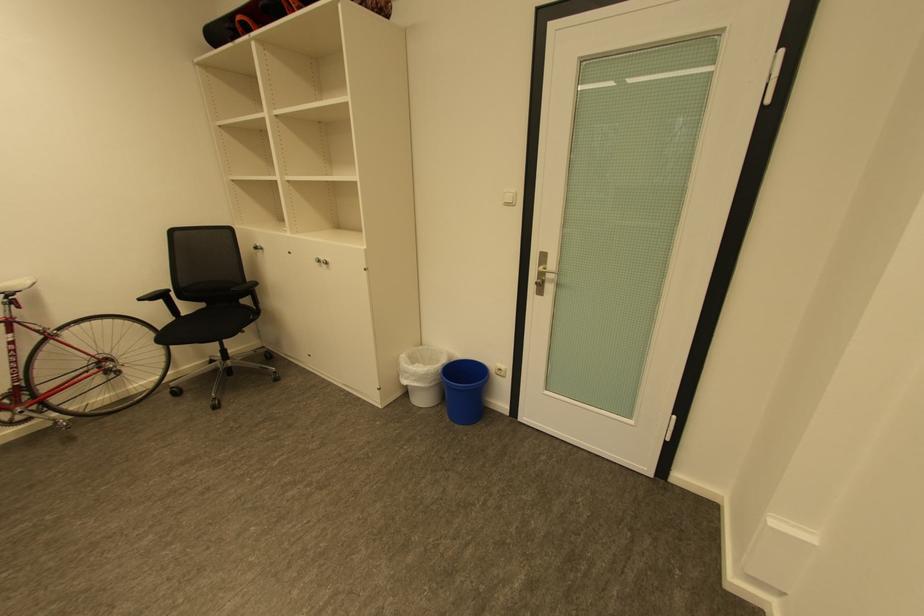
The width and height of the screenshot is (924, 616). Find the location of `chair armrest`. chair armrest is located at coordinates (160, 298).